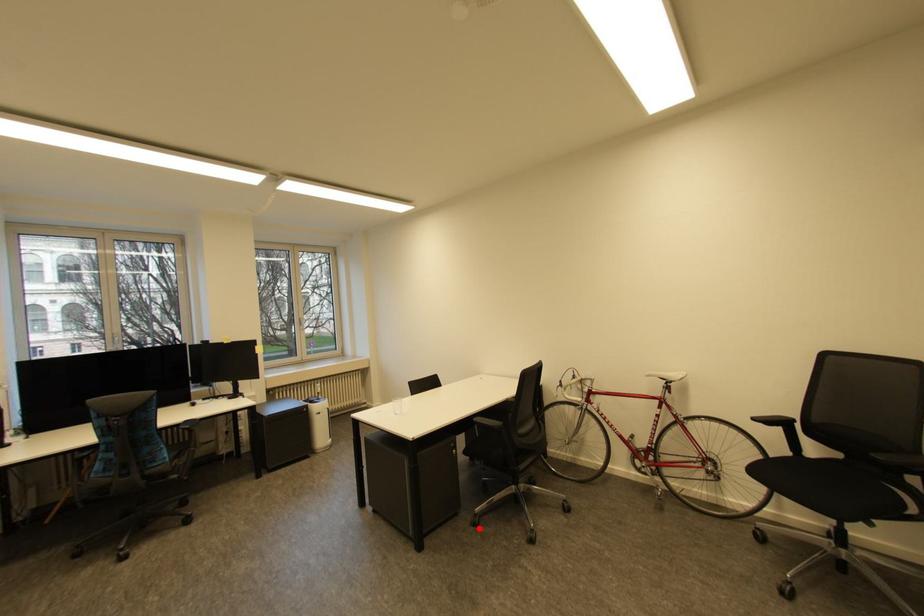
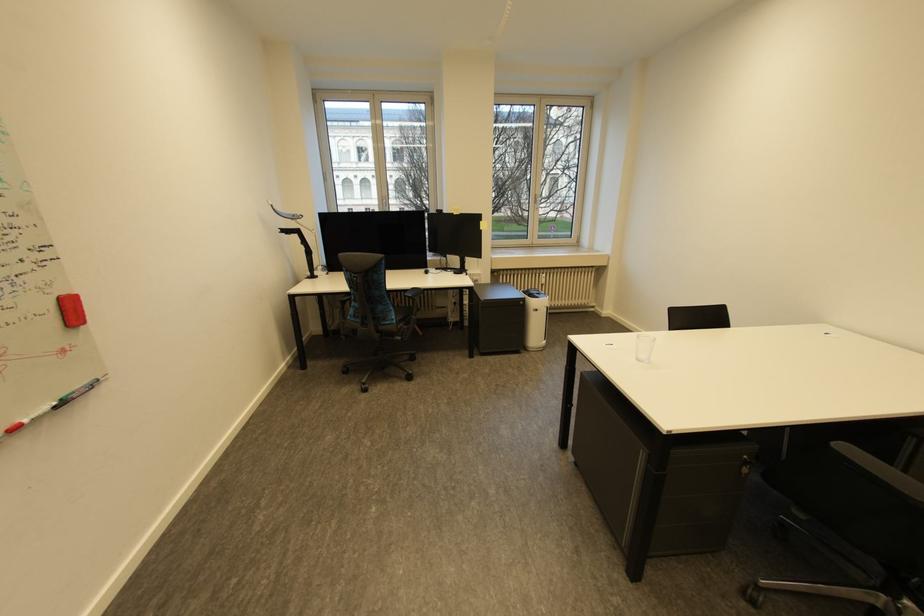
Question: I am providing you with two images of the same scene from different viewpoints. In image1, a red point is highlighted. Considering the same 3D point in image2, which of the following is correct?

Choices:
 (A) It is closer
 (B) It is farther

Answer: (A)